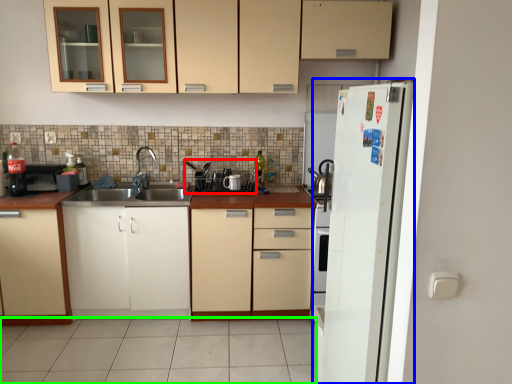
Question: Based on their relative distances, which object is farther from appliance (highlighted by a red box)? Choose from refrigerator (highlighted by a blue box) and tile (highlighted by a green box).

Choices:
 (A) refrigerator
 (B) tile

Answer: (A)